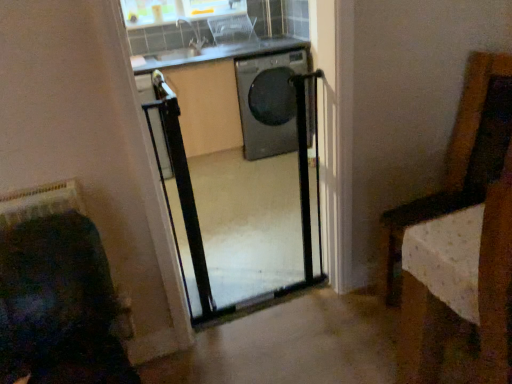
Question: Is black metal screen door at center inside or outside of clear plastic basket at upper center?

Choices:
 (A) inside
 (B) outside

Answer: (B)

Question: From the image's perspective, is black metal screen door at center above or below clear plastic basket at upper center?

Choices:
 (A) above
 (B) below

Answer: (B)

Question: Considering the real-world distances, which object is farthest from the clear plastic basket at upper center?

Choices:
 (A) black metal screen door at center
 (B) transparent plastic window at upper center
 (C) black glossy washing machine at center

Answer: (A)

Question: Based on their relative distances, which object is farther from the black metal screen door at center?

Choices:
 (A) clear plastic basket at upper center
 (B) transparent plastic window at upper center
 (C) black glossy washing machine at center

Answer: (B)